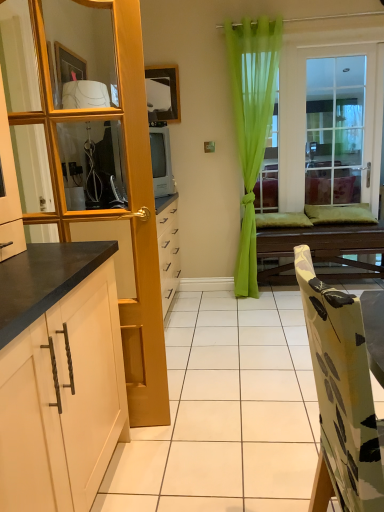
You are a GUI agent. You are given a task and a screenshot of the screen. Output one action in this format:
    pyautogui.click(x=<x>, y=<y>)
    Task: Click on the blank space situated above clear glass window at center (from a real-world perspective)
    Image resolution: width=384 pixels, height=512 pixels.
    Given the screenshot: What is the action you would take?
    pyautogui.click(x=344, y=42)